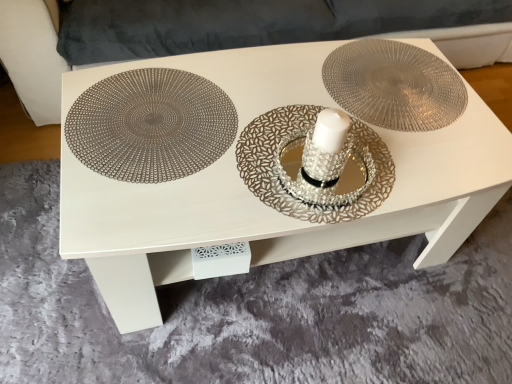
Where is `free area in between silver textured plate at center and metallic textured saucer at center`? free area in between silver textured plate at center and metallic textured saucer at center is located at coordinates click(361, 122).